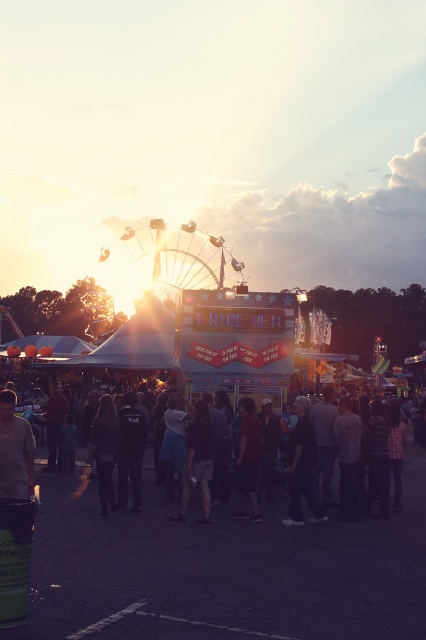
Which of these two, dark gray jacket at center or dark red shirt at center, stands shorter?

dark red shirt at center is shorter.

Who is more forward, (314,516) or (245,406)?

Point (314,516) is more forward.

Locate an element on the screen. The width and height of the screenshot is (426, 640). dark gray jacket at center is located at coordinates (302, 467).

Does dark gray casual clothing at center have a smaller size compared to dark gray jacket at center?

Incorrect, dark gray casual clothing at center is not smaller in size than dark gray jacket at center.

Looking at this image, is dark gray casual clothing at center to the right of dark gray jacket at center from the viewer's perspective?

No, dark gray casual clothing at center is not to the right of dark gray jacket at center.

Is point (137, 525) positioned after point (301, 506)?

No, (137, 525) is in front of (301, 506).

What are the coordinates of `dark gray casual clothing at center` in the screenshot? It's located at (212, 522).

Does dark gray casual clothing at center have a smaller size compared to dark red shirt at center?

Actually, dark gray casual clothing at center might be larger than dark red shirt at center.

Measure the distance between point (310,545) and camera.

27.19 meters

Between point (328, 515) and point (249, 451), which one is positioned behind?

The point (249, 451) is behind.

The height and width of the screenshot is (640, 426). I want to click on dark gray casual clothing at center, so click(212, 522).